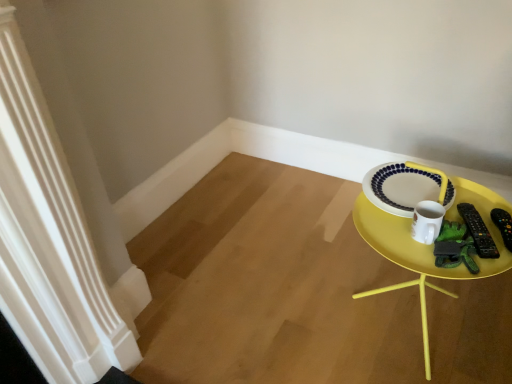
The height and width of the screenshot is (384, 512). Identify the location of vacant space underneath yellow plastic tray at right (from a real-world perspective). (413, 330).